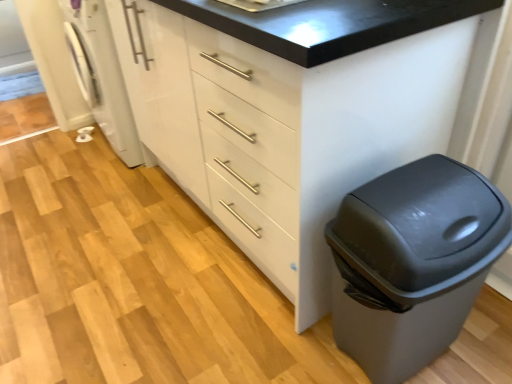
I want to click on vacant region to the left of white glossy cabinet at center, so click(98, 237).